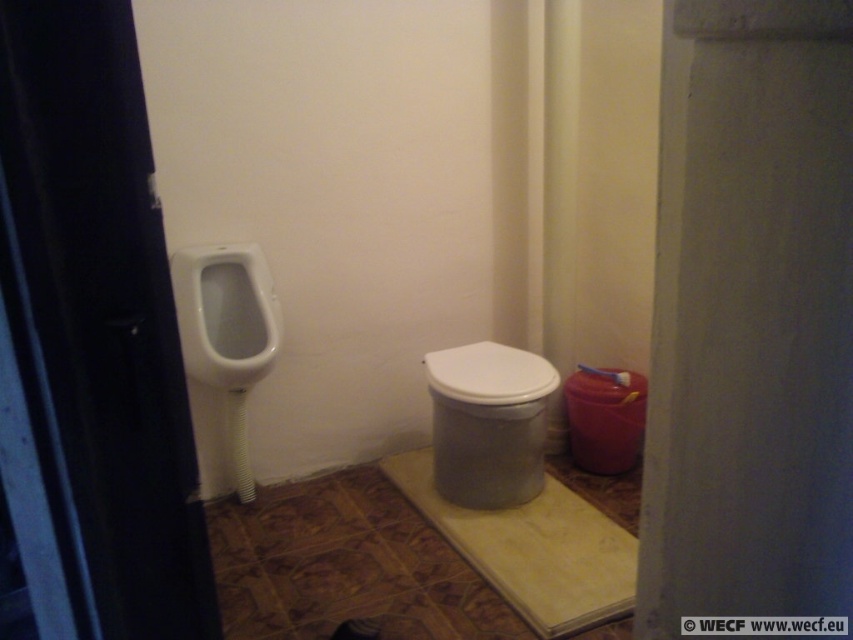
Question: Where is white glossy toilet at center located in relation to white glossy urinal at left in the image?

Choices:
 (A) left
 (B) right

Answer: (B)

Question: Which point appears closest to the camera in this image?

Choices:
 (A) (483, 356)
 (B) (219, 371)

Answer: (B)

Question: In this image, where is white glossy toilet at center located relative to white glossy urinal at left?

Choices:
 (A) left
 (B) right

Answer: (B)

Question: Does white glossy toilet at center have a smaller size compared to white glossy urinal at left?

Choices:
 (A) no
 (B) yes

Answer: (B)